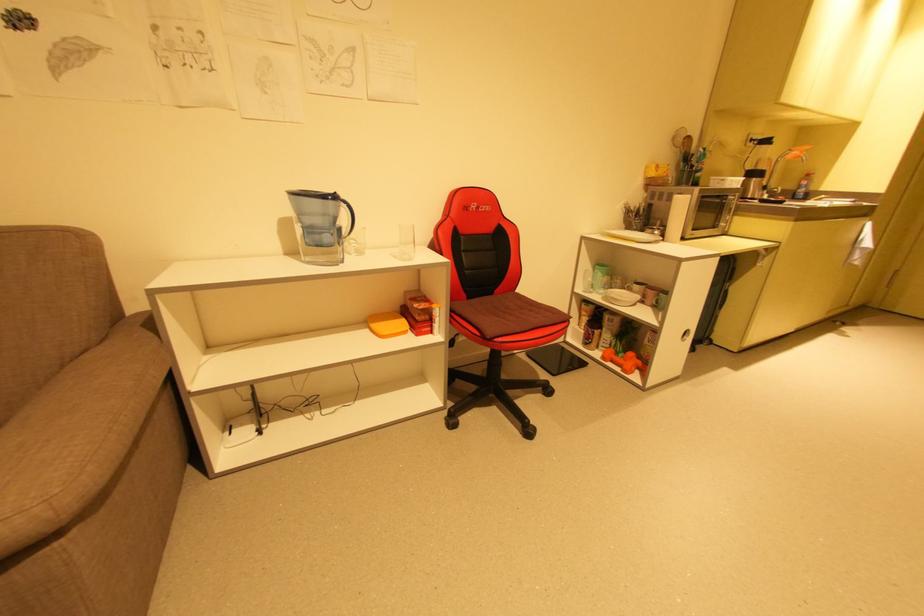
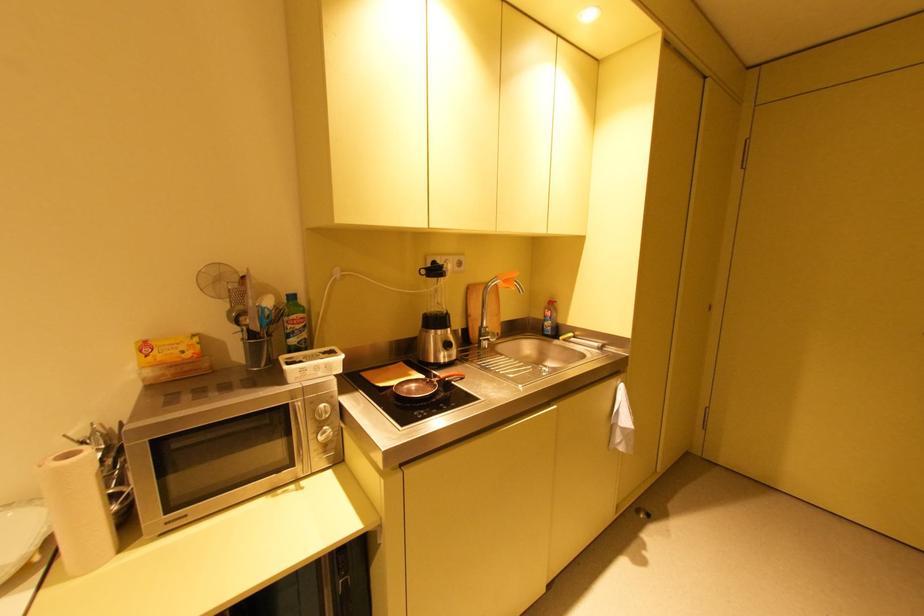
Find the pixel in the second image that matches [762,180] in the first image.

(444, 331)